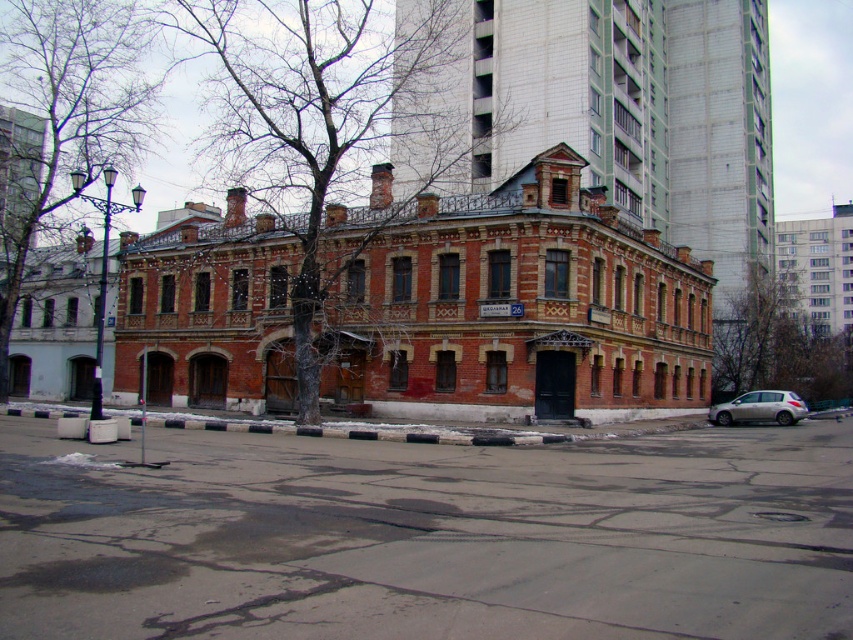
Can you confirm if bare branches at left is positioned to the left of bare branches at right?

Yes, bare branches at left is to the left of bare branches at right.

You are a GUI agent. You are given a task and a screenshot of the screen. Output one action in this format:
    pyautogui.click(x=<x>, y=<y>)
    Task: Click on the bare branches at left
    
    Given the screenshot: What is the action you would take?
    pyautogui.click(x=64, y=118)

What do you see at coordinates (64, 118) in the screenshot? I see `bare branches at left` at bounding box center [64, 118].

Where is `bare branches at left`? The image size is (853, 640). bare branches at left is located at coordinates (64, 118).

Consider the image. Is bare wood tree at center taller than bare branches at left?

Yes.

Is point (233, 60) farther from viewer compared to point (122, 13)?

Yes, point (233, 60) is behind point (122, 13).

The width and height of the screenshot is (853, 640). In order to click on bare wood tree at center in this screenshot , I will do `click(294, 120)`.

Measure the distance between bare branches at right and silver metallic car at lower right.

bare branches at right is 19.48 meters away from silver metallic car at lower right.

Is point (782, 300) closer to camera compared to point (718, 417)?

No, it is behind (718, 417).

Describe the element at coordinates (776, 344) in the screenshot. I see `bare branches at right` at that location.

Locate an element on the screen. bare branches at right is located at coordinates (776, 344).